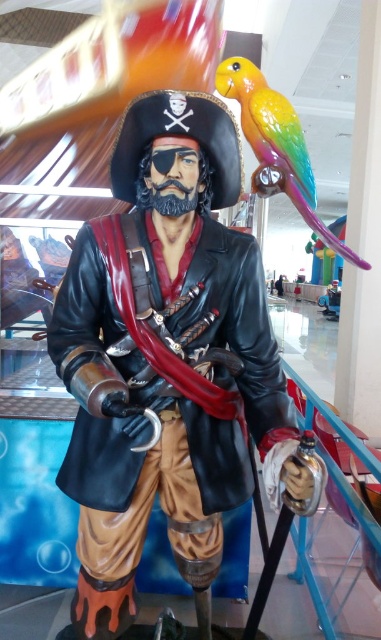
You are a photographer trying to capture both the glossy black pirate at center and the rainbow glossy parrot at upper right in a single frame. Considering their sizes, which object should you zoom in on to ensure both fit comfortably in the photo?

Since the glossy black pirate at center is narrower than the rainbow glossy parrot at upper right, you should zoom in on the rainbow glossy parrot at upper right to ensure both fit comfortably in the photo.

Based on the photo, you are a visitor standing in front of the pirate statue. You want to take a photo of the rainbow glossy parrot at upper right without the glossy black pirate at center blocking the view. Is this possible?

The glossy black pirate at center is in front of the rainbow glossy parrot at upper right, so the pirate will block the view of the parrot. You cannot take a photo of the rainbow glossy parrot at upper right without the glossy black pirate at center blocking the view.